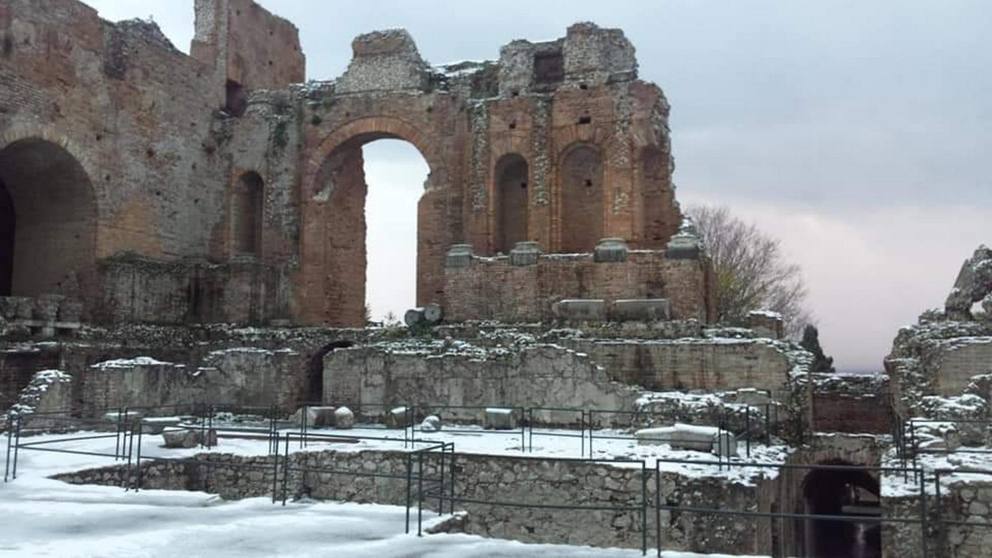
Where is `more crumbling wall`? more crumbling wall is located at coordinates (954, 307).